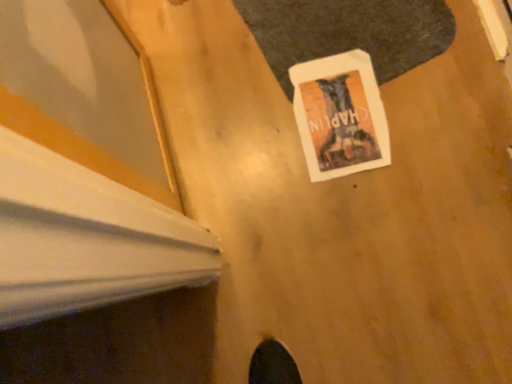
The image size is (512, 384). Identify the location of free location to the right of white paper at center. (430, 83).